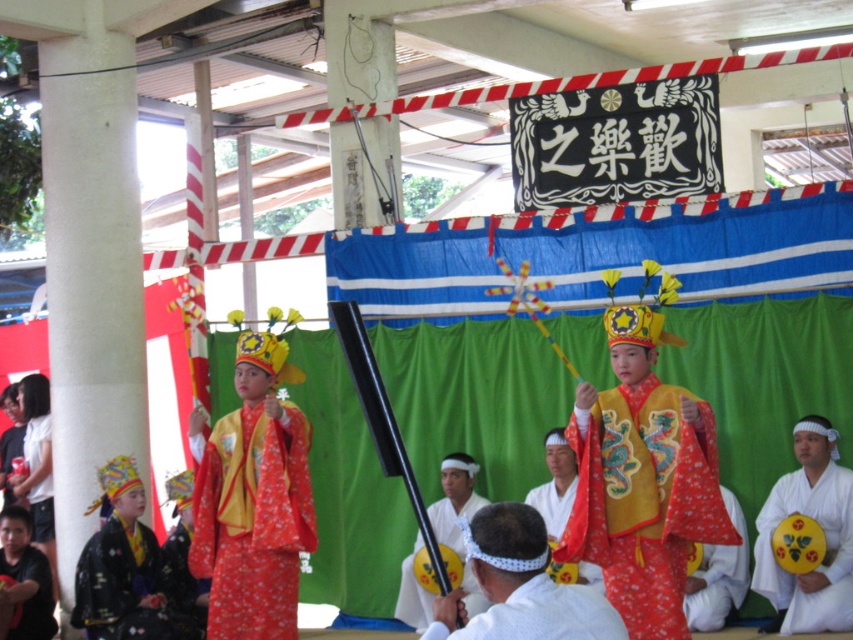
Based on the photo, in the scene of the cultural performance, there are two performers wearing the shiny gold dragon robe at center and the floral silk robe at center. From the audience perspective, which robe is positioned to the right?

The shiny gold dragon robe at center is to the right of the floral silk robe at center.

You are a photographer positioned at the edge of the stage. You need to capture a photo that includes both the shiny gold dragon robe at center and the floral silk robe at center. What is the minimum distance you need to move backward to ensure both are in frame?

The shiny gold dragon robe at center is 3.06 meters from the floral silk robe at center. To include both in the frame, you need to move backward at least 3.06 meters from the closest robe to ensure the entire distance between them fits within the camera view.

You are an event photographer at the cultural performance. You need to capture a photo of both the shiny gold dragon robe at center and the white cotton kimono at center. Based on their positions, which one should you focus on first to ensure both are in frame?

The shiny gold dragon robe at center is above the white cotton kimono at center, so you should focus on the white cotton kimono at center first to ensure both are in frame.